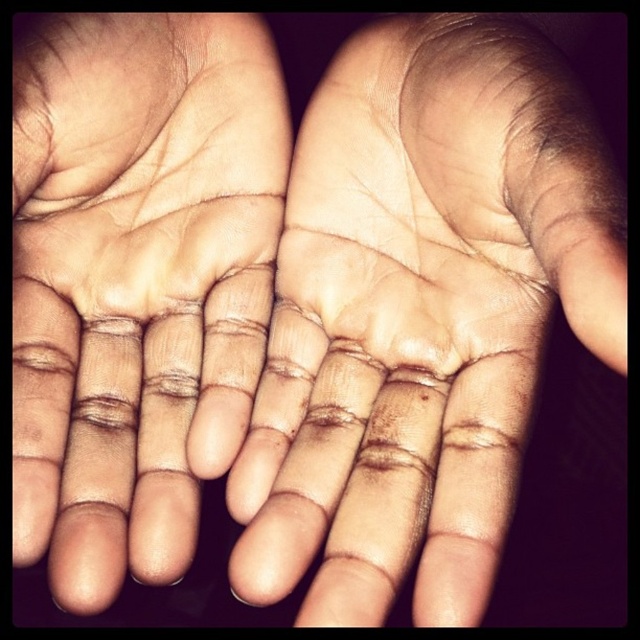
Question: Does light skin tone palm at center appear on the left side of dry skin palm at center?

Choices:
 (A) no
 (B) yes

Answer: (A)

Question: Can you confirm if light skin tone palm at center is smaller than dry skin palm at center?

Choices:
 (A) yes
 (B) no

Answer: (B)

Question: Which point appears closest to the camera in this image?

Choices:
 (A) (500, 230)
 (B) (80, 460)

Answer: (A)

Question: Considering the relative positions of light skin tone palm at center and dry skin palm at center in the image provided, where is light skin tone palm at center located with respect to dry skin palm at center?

Choices:
 (A) below
 (B) above

Answer: (A)